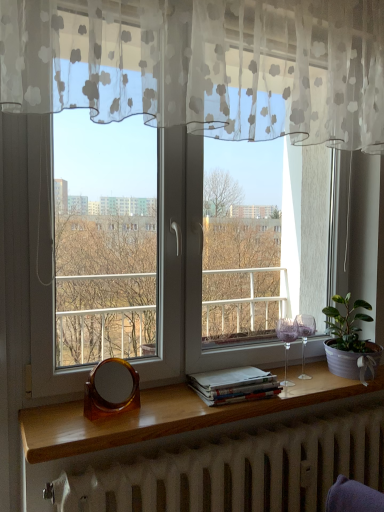
Question: Is green leafy plant in textured pot at right taller or shorter than brown tortoiseshell mirror at lower center?

Choices:
 (A) short
 (B) tall

Answer: (B)

Question: Is point (349, 344) closer or farther from the camera than point (102, 404)?

Choices:
 (A) closer
 (B) farther

Answer: (B)

Question: Considering the real-world distances, which object is closest to the white matte radiator at lower center?

Choices:
 (A) wooden at lower center
 (B) brown tortoiseshell mirror at lower center
 (C) white paper stack at lower center
 (D) transparent glass window at center
 (E) green leafy plant in textured pot at right

Answer: (A)

Question: Considering the real-world distances, which object is farthest from the green leafy plant in textured pot at right?

Choices:
 (A) brown tortoiseshell mirror at lower center
 (B) white paper stack at lower center
 (C) white matte radiator at lower center
 (D) wooden at lower center
 (E) transparent glass window at center

Answer: (A)